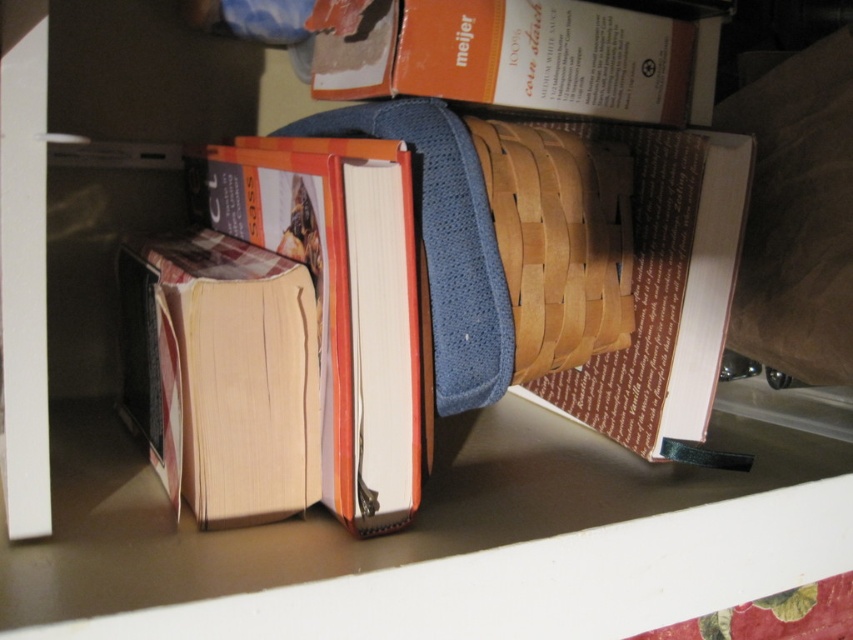
Question: Which of the following is the closest to the observer?

Choices:
 (A) brown paper at center
 (B) natural wood basket at center
 (C) orange paper at center

Answer: (C)

Question: Which point is farther to the camera?

Choices:
 (A) (338, 160)
 (B) (711, 401)
 (C) (199, 310)
 (D) (498, 17)

Answer: (B)

Question: Does orange paper at center appear over beige paper at center?

Choices:
 (A) no
 (B) yes

Answer: (B)

Question: Does beige paper at center have a larger size compared to brown paper at center?

Choices:
 (A) yes
 (B) no

Answer: (A)

Question: From the image, what is the correct spatial relationship of orange paper at center in relation to orange cardboard box at upper center?

Choices:
 (A) right
 (B) left

Answer: (B)

Question: Estimate the real-world distances between objects in this image. Which object is closer to the orange paper at center?

Choices:
 (A) natural wood basket at center
 (B) brown paper at center

Answer: (A)